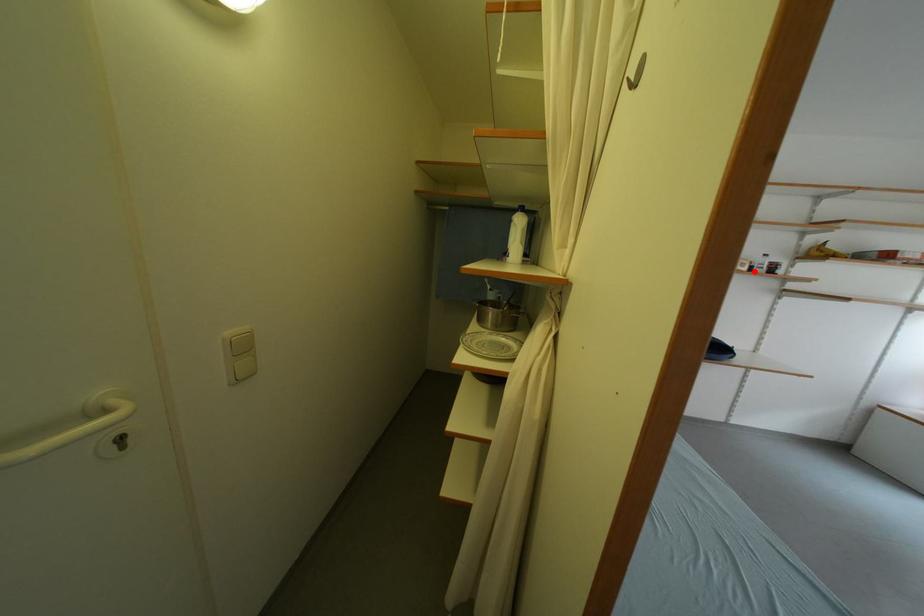
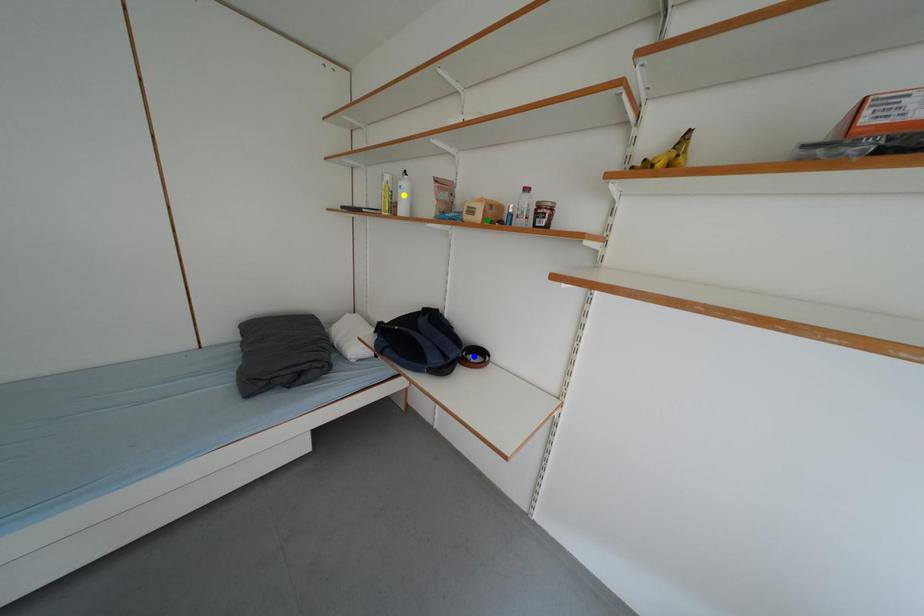
Question: I am providing you with two images of the same scene from different viewpoints. A red point is marked on the first image. You are given multiple points on the second image. Which mark in image 2 goes with the point in image 1?

Choices:
 (A) blue point
 (B) yellow point
 (C) green point

Answer: (C)